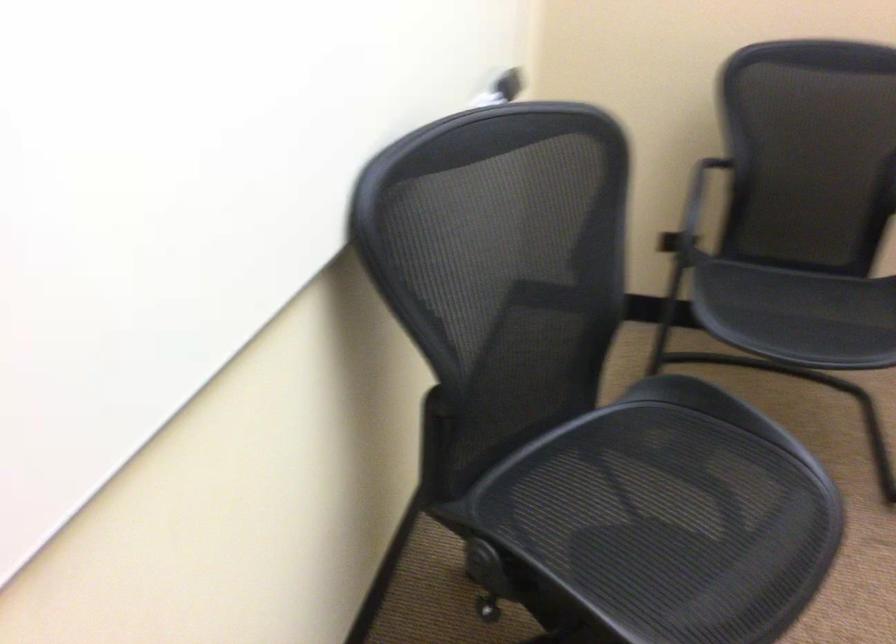
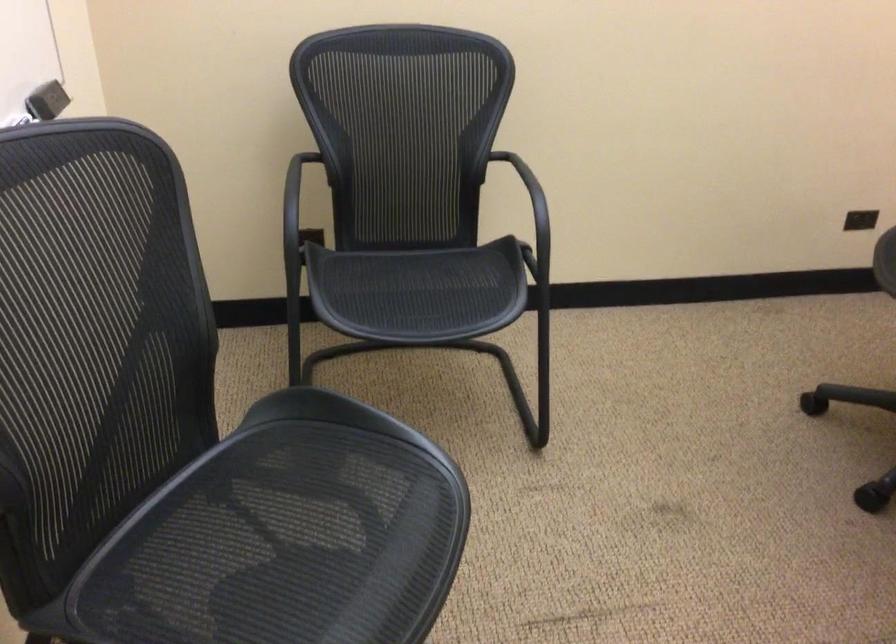
Where in the second image is the point corresponding to (788,290) from the first image?

(409, 287)